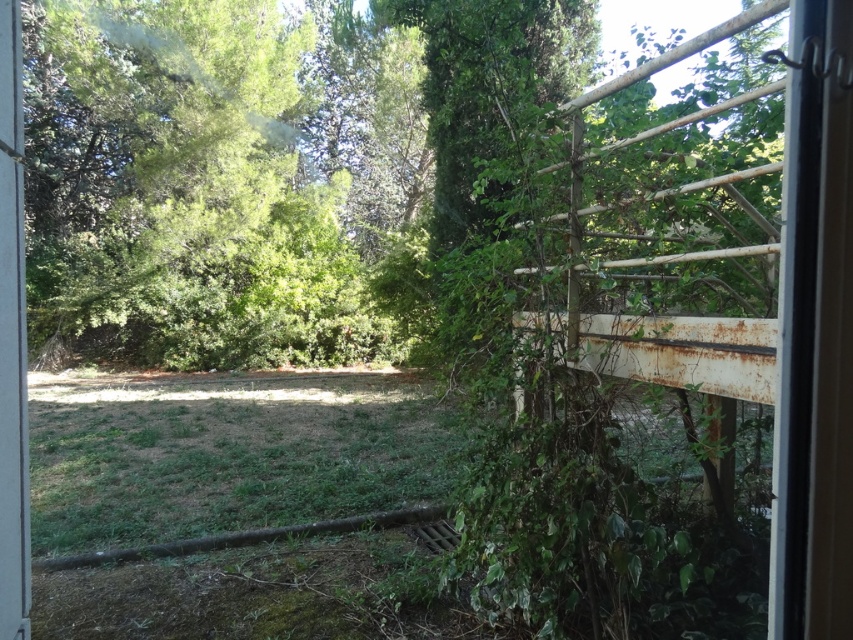
Which is in front, point (792, 627) or point (12, 387)?

Positioned in front is point (792, 627).

Is clear glass screen door at right to the left of white plastic screen door at left from the viewer's perspective?

Incorrect, clear glass screen door at right is not on the left side of white plastic screen door at left.

Image resolution: width=853 pixels, height=640 pixels. Find the location of `clear glass screen door at right`. clear glass screen door at right is located at coordinates (816, 330).